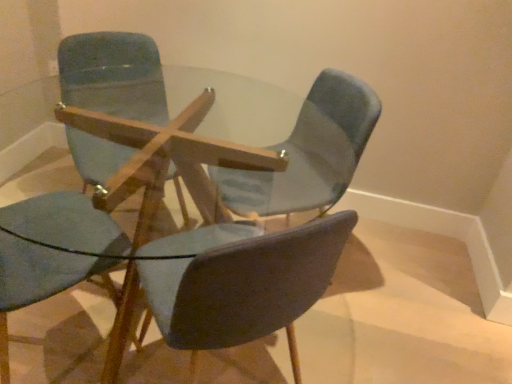
The width and height of the screenshot is (512, 384). Find the location of `light blue fabric chair at center, which is the first chair from right to left`. light blue fabric chair at center, which is the first chair from right to left is located at coordinates (310, 152).

Where is `matte blue chair at upper left, the 3th chair positioned from the right`? This screenshot has width=512, height=384. matte blue chair at upper left, the 3th chair positioned from the right is located at coordinates (113, 75).

Image resolution: width=512 pixels, height=384 pixels. What do you see at coordinates (113, 75) in the screenshot?
I see `matte blue chair at upper left, the fourth chair viewed from the right` at bounding box center [113, 75].

The width and height of the screenshot is (512, 384). What do you see at coordinates (246, 286) in the screenshot? I see `matte blue chair at center, which is counted as the 3th chair, starting from the left` at bounding box center [246, 286].

Locate an element on the screen. The width and height of the screenshot is (512, 384). light blue fabric chair at center, which is the first chair from right to left is located at coordinates (310, 152).

Can you confirm if matte blue chair at upper left, the 3th chair positioned from the right, is taller than light blue fabric chair at center, marked as the fourth chair in a left-to-right arrangement?

Yes, matte blue chair at upper left, the 3th chair positioned from the right, is taller than light blue fabric chair at center, marked as the fourth chair in a left-to-right arrangement.

Consider the image. From a real-world perspective, is matte blue chair at upper left, the 3th chair positioned from the right, above or below light blue fabric chair at center, marked as the fourth chair in a left-to-right arrangement?

From a real-world perspective, matte blue chair at upper left, the 3th chair positioned from the right, is physically above light blue fabric chair at center, marked as the fourth chair in a left-to-right arrangement.

Does matte blue chair at upper left, the 3th chair positioned from the right, have a lesser width compared to light blue fabric chair at center, which is the first chair from right to left?

Correct, the width of matte blue chair at upper left, the 3th chair positioned from the right, is less than that of light blue fabric chair at center, which is the first chair from right to left.

Based on the photo, do you think matte blue chair at upper left, marked as the 2th chair in a left-to-right arrangement, is within light blue fabric chair at center, which is the first chair from right to left, or outside of it?

matte blue chair at upper left, marked as the 2th chair in a left-to-right arrangement, lies outside light blue fabric chair at center, which is the first chair from right to left.

Is matte blue chair at center, which is the second chair in right-to-left order, positioned before light blue fabric chair at center, which is the first chair from right to left?

That is True.

Looking at this image, visually, is matte blue chair at center, which is counted as the 3th chair, starting from the left, positioned to the left or to the right of light blue fabric chair at center, marked as the fourth chair in a left-to-right arrangement?

Based on their positions, matte blue chair at center, which is counted as the 3th chair, starting from the left, is located to the left of light blue fabric chair at center, marked as the fourth chair in a left-to-right arrangement.

Is matte blue chair at center, which is the second chair in right-to-left order, touching light blue fabric chair at center, which is the first chair from right to left?

No.

From a real-world perspective, is matte blue chair at center, which is counted as the 3th chair, starting from the left, on light blue fabric chair at center, which is the first chair from right to left?

Yes, from a real-world perspective, matte blue chair at center, which is counted as the 3th chair, starting from the left, is over light blue fabric chair at center, which is the first chair from right to left

Does point (193, 370) lie in front of point (116, 57)?

Yes, point (193, 370) is closer to viewer.

From a real-world perspective, relative to matte blue chair at upper left, marked as the 2th chair in a left-to-right arrangement, is matte blue chair at center, which is counted as the 3th chair, starting from the left, vertically above or below?

In terms of real-world spatial position, matte blue chair at center, which is counted as the 3th chair, starting from the left, is below matte blue chair at upper left, marked as the 2th chair in a left-to-right arrangement.

Does matte blue chair at center, which is the second chair in right-to-left order, contain matte blue chair at upper left, marked as the 2th chair in a left-to-right arrangement?

No, matte blue chair at upper left, marked as the 2th chair in a left-to-right arrangement, is not a part of matte blue chair at center, which is the second chair in right-to-left order.

Which of these two, matte blue chair at upper left, the first chair viewed from the left, or light blue fabric chair at center, which is the first chair from right to left, is thinner?

matte blue chair at upper left, the first chair viewed from the left, is thinner.

From a real-world perspective, is matte blue chair at upper left, the fourth chair viewed from the right, on light blue fabric chair at center, marked as the fourth chair in a left-to-right arrangement?

Yes, from a real-world perspective, matte blue chair at upper left, the fourth chair viewed from the right, is over light blue fabric chair at center, marked as the fourth chair in a left-to-right arrangement

Is matte blue chair at upper left, the first chair viewed from the left, to the left or to the right of light blue fabric chair at center, which is the first chair from right to left, in the image?

From the image, it's evident that matte blue chair at upper left, the first chair viewed from the left, is to the left of light blue fabric chair at center, which is the first chair from right to left.

Is point (179, 345) farther from camera compared to point (72, 224)?

No, (179, 345) is in front of (72, 224).

Locate an element on the screen. the 2nd chair counting from the right of the matte blue chair at upper left, the first chair viewed from the left is located at coordinates (246, 286).

How many degrees apart are the facing directions of matte blue chair at center, which is counted as the 3th chair, starting from the left, and matte blue chair at upper left, the fourth chair viewed from the right?

matte blue chair at center, which is counted as the 3th chair, starting from the left, and matte blue chair at upper left, the fourth chair viewed from the right, are facing 73 degrees away from each other.

Are matte blue chair at center, which is counted as the 3th chair, starting from the left, and matte blue chair at upper left, the fourth chair viewed from the right, beside each other?

No, matte blue chair at center, which is counted as the 3th chair, starting from the left, is not touching matte blue chair at upper left, the fourth chair viewed from the right.

From a real-world perspective, is light blue fabric chair at center, which is the first chair from right to left, positioned under matte blue chair at center, which is counted as the 3th chair, starting from the left, based on gravity?

Yes.

Which point is more forward, (360, 132) or (300, 305)?

The point (300, 305) is closer to the camera.

Consider the image. Is light blue fabric chair at center, which is the first chair from right to left, facing away from matte blue chair at center, which is counted as the 3th chair, starting from the left?

No, light blue fabric chair at center, which is the first chair from right to left,'s orientation is not away from matte blue chair at center, which is counted as the 3th chair, starting from the left.

From the matte blue chair at center, which is counted as the 3th chair, starting from the left, count 2nd chairs backward and point to it. Please provide its 2D coordinates.

[(310, 152)]

Is matte blue chair at upper left, marked as the 2th chair in a left-to-right arrangement, oriented away from matte blue chair at upper left, the fourth chair viewed from the right?

No, matte blue chair at upper left, marked as the 2th chair in a left-to-right arrangement, is not facing the opposite direction of matte blue chair at upper left, the fourth chair viewed from the right.

Which of these two, matte blue chair at upper left, marked as the 2th chair in a left-to-right arrangement, or matte blue chair at upper left, the fourth chair viewed from the right, is bigger?

With larger size is matte blue chair at upper left, marked as the 2th chair in a left-to-right arrangement.

Between matte blue chair at upper left, marked as the 2th chair in a left-to-right arrangement, and matte blue chair at upper left, the first chair viewed from the left, which one is positioned in front?

matte blue chair at upper left, the first chair viewed from the left.

Find the location of a particular element. The height and width of the screenshot is (384, 512). the 2nd chair above when counting from the matte blue chair at upper left, the fourth chair viewed from the right (from the image's perspective) is located at coordinates (113, 75).

The width and height of the screenshot is (512, 384). In order to click on chair that is the 3rd object above the light blue fabric chair at center, marked as the fourth chair in a left-to-right arrangement (from a real-world perspective) in this screenshot , I will do `click(113, 75)`.

Where is `the 2nd chair behind the matte blue chair at center, which is the second chair in right-to-left order`? The height and width of the screenshot is (384, 512). the 2nd chair behind the matte blue chair at center, which is the second chair in right-to-left order is located at coordinates (310, 152).

Looking at the image, which one is located further to matte blue chair at center, which is the second chair in right-to-left order, matte blue chair at upper left, the first chair viewed from the left, or matte blue chair at upper left, marked as the 2th chair in a left-to-right arrangement?

matte blue chair at upper left, marked as the 2th chair in a left-to-right arrangement.

Looking at the image, which one is located closer to matte blue chair at upper left, the fourth chair viewed from the right, matte blue chair at center, which is counted as the 3th chair, starting from the left, or light blue fabric chair at center, which is the first chair from right to left?

matte blue chair at center, which is counted as the 3th chair, starting from the left, lies closer to matte blue chair at upper left, the fourth chair viewed from the right, than the other object.

Estimate the real-world distances between objects in this image. Which object is closer to matte blue chair at upper left, the first chair viewed from the left, matte blue chair at upper left, marked as the 2th chair in a left-to-right arrangement, or light blue fabric chair at center, marked as the fourth chair in a left-to-right arrangement?

Among the two, matte blue chair at upper left, marked as the 2th chair in a left-to-right arrangement, is located nearer to matte blue chair at upper left, the first chair viewed from the left.

When comparing their distances from light blue fabric chair at center, which is the first chair from right to left, does matte blue chair at upper left, the fourth chair viewed from the right, or matte blue chair at center, which is the second chair in right-to-left order, seem further?

matte blue chair at center, which is the second chair in right-to-left order, is further to light blue fabric chair at center, which is the first chair from right to left.

Which object lies nearer to the anchor point matte blue chair at center, which is the second chair in right-to-left order, light blue fabric chair at center, which is the first chair from right to left, or matte blue chair at upper left, the first chair viewed from the left?

matte blue chair at upper left, the first chair viewed from the left, is closer to matte blue chair at center, which is the second chair in right-to-left order.

Looking at this image, considering their positions, is matte blue chair at upper left, marked as the 2th chair in a left-to-right arrangement, positioned closer to light blue fabric chair at center, marked as the fourth chair in a left-to-right arrangement, than matte blue chair at upper left, the first chair viewed from the left?

matte blue chair at upper left, the first chair viewed from the left.

Based on their spatial positions, is matte blue chair at center, which is the second chair in right-to-left order, or matte blue chair at upper left, marked as the 2th chair in a left-to-right arrangement, closer to matte blue chair at upper left, the first chair viewed from the left?

Based on the image, matte blue chair at center, which is the second chair in right-to-left order, appears to be nearer to matte blue chair at upper left, the first chair viewed from the left.

Based on their spatial positions, is light blue fabric chair at center, marked as the fourth chair in a left-to-right arrangement, or matte blue chair at center, which is the second chair in right-to-left order, further from matte blue chair at upper left, the 3th chair positioned from the right?

Answer: matte blue chair at center, which is the second chair in right-to-left order, is further to matte blue chair at upper left, the 3th chair positioned from the right.

Locate an element on the screen. This screenshot has width=512, height=384. chair between matte blue chair at upper left, marked as the 2th chair in a left-to-right arrangement, and light blue fabric chair at center, which is the first chair from right to left, in the horizontal direction is located at coordinates (246, 286).

Locate an element on the screen. Image resolution: width=512 pixels, height=384 pixels. chair situated between matte blue chair at upper left, the fourth chair viewed from the right, and matte blue chair at center, which is the second chair in right-to-left order, from left to right is located at coordinates (113, 75).